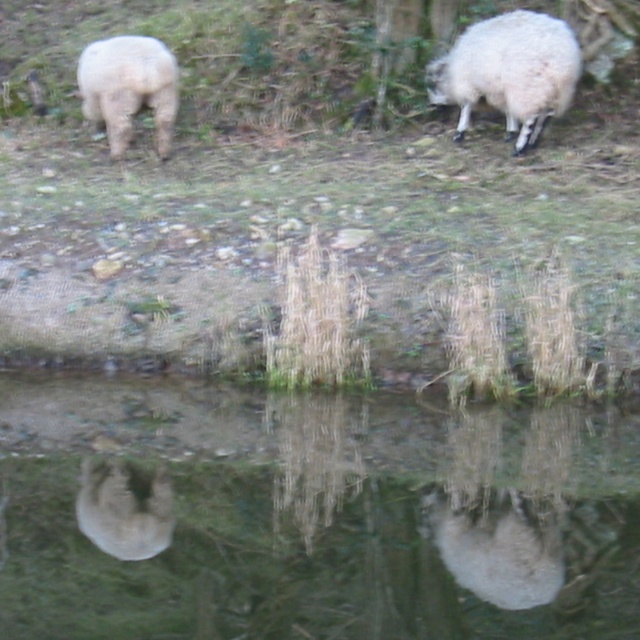
Question: Which of the following is the closest to the observer?

Choices:
 (A) (460, 566)
 (B) (104, 113)
 (C) (552, 38)
 (D) (4, 490)

Answer: (A)

Question: Which point appears closest to the camera in this image?

Choices:
 (A) (582, 481)
 (B) (156, 140)
 (C) (516, 52)
 (D) (499, 436)

Answer: (A)

Question: Where is white woolly sheep at upper right located in relation to white woolly sheep at upper left in the image?

Choices:
 (A) below
 (B) above

Answer: (A)

Question: Is transparent glass puddle at center above white woolly sheep at upper right?

Choices:
 (A) yes
 (B) no

Answer: (B)

Question: Considering the real-world distances, which object is closest to the white fluffy sheep at lower center?

Choices:
 (A) white woolly sheep at upper right
 (B) white woolly sheep at upper left
 (C) transparent glass puddle at center

Answer: (C)

Question: Is transparent glass puddle at center positioned behind white woolly sheep at upper right?

Choices:
 (A) yes
 (B) no

Answer: (B)